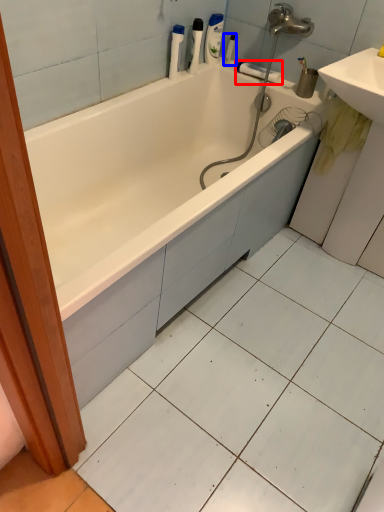
Question: Which object appears closest to the camera in this image, towel bar (highlighted by a red box) or toiletry (highlighted by a blue box)?

Choices:
 (A) towel bar
 (B) toiletry

Answer: (A)